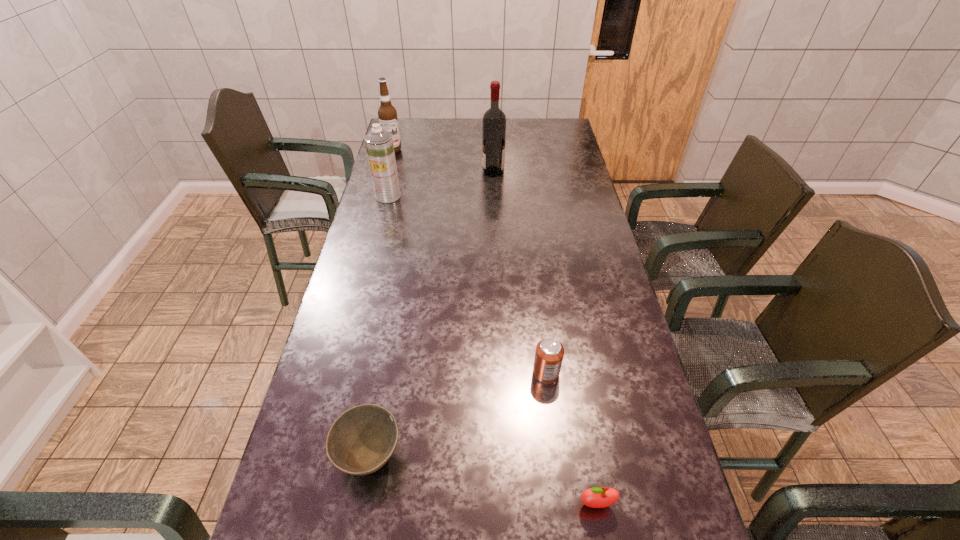
I want to click on vacant space at the far edge, so click(527, 130).

The image size is (960, 540). Find the location of `vacant space at the left edge of the desktop`. vacant space at the left edge of the desktop is located at coordinates (395, 202).

In the image, there is a desktop. Identify the location of vacant space at the right edge. This screenshot has height=540, width=960. (559, 211).

The height and width of the screenshot is (540, 960). What are the coordinates of `vacant area that lies between the aerosol can and the apple` in the screenshot? It's located at (492, 350).

Find the location of `blank region between the fourth farthest object and the bowl`. blank region between the fourth farthest object and the bowl is located at coordinates (458, 415).

Where is `free spot between the can and the apple`? free spot between the can and the apple is located at coordinates (571, 438).

I want to click on vacant region between the second nearest object and the shorter alcohol, so click(381, 303).

The width and height of the screenshot is (960, 540). In order to click on free area in between the can and the bowl in this screenshot , I will do `click(458, 415)`.

This screenshot has height=540, width=960. Identify the location of unoccupied area between the third nearest object and the third farthest object. (467, 284).

The width and height of the screenshot is (960, 540). What are the coordinates of `free space between the farther alcohol and the second nearest object` in the screenshot? It's located at 381,303.